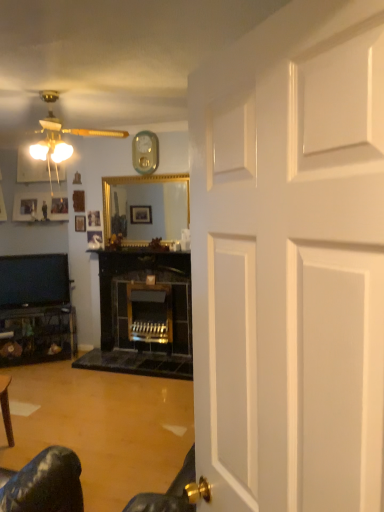
The image size is (384, 512). What are the coordinates of `free location above gold-framed mirror at center (from a real-world perspective)` in the screenshot? It's located at (134, 174).